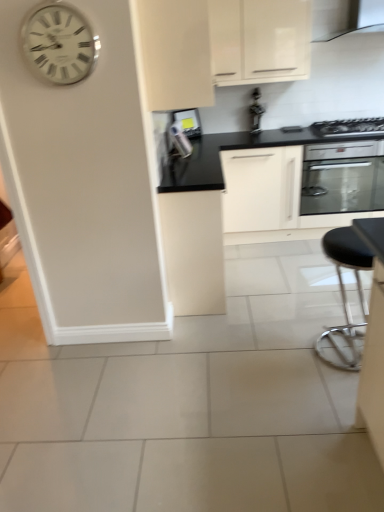
The width and height of the screenshot is (384, 512). I want to click on white matte cabinet at upper center, the 2th cabinetry ordered from the bottom, so coord(175,53).

Describe the element at coordinates (175, 53) in the screenshot. I see `white matte cabinet at upper center, the 2th cabinetry when ordered from top to bottom` at that location.

In order to face black leather stool at lower right, should I rotate leftwards or rightwards?

It's best to rotate right around 20.723 degrees.

What do you see at coordinates (194, 251) in the screenshot?
I see `matte white cabinet at center, the first cabinetry positioned from the bottom` at bounding box center [194, 251].

The height and width of the screenshot is (512, 384). What do you see at coordinates (59, 44) in the screenshot?
I see `white metallic clock at upper left` at bounding box center [59, 44].

At what (x,y) coordinates should I click in order to perform the action: click on white metallic clock at upper left. Please return your answer as a coordinate pair (x, y). Image resolution: width=384 pixels, height=512 pixels. Looking at the image, I should click on (59, 44).

You are a GUI agent. You are given a task and a screenshot of the screen. Output one action in this format:
    pyautogui.click(x=<x>, y=<y>)
    Task: Click on the satin black oven at upper right
    
    Given the screenshot: What is the action you would take?
    pyautogui.click(x=350, y=127)

Based on their sizes in the image, would you say white metallic clock at upper left is bigger or smaller than white glossy cabinet at upper center, positioned as the third cabinetry in bottom-to-top order?

In the image, white metallic clock at upper left appears to be smaller than white glossy cabinet at upper center, positioned as the third cabinetry in bottom-to-top order.

Looking at this image, is white metallic clock at upper left not inside white glossy cabinet at upper center, positioned as the third cabinetry in bottom-to-top order?

white metallic clock at upper left is positioned outside white glossy cabinet at upper center, positioned as the third cabinetry in bottom-to-top order.

Considering the relative positions of white metallic clock at upper left and white glossy cabinet at upper center, positioned as the third cabinetry in bottom-to-top order, in the image provided, is white metallic clock at upper left to the left or to the right of white glossy cabinet at upper center, positioned as the third cabinetry in bottom-to-top order,?

Based on their positions, white metallic clock at upper left is located to the left of white glossy cabinet at upper center, positioned as the third cabinetry in bottom-to-top order.

Does white metallic clock at upper left have a greater height compared to white glossy cabinet at upper center, the first cabinetry positioned from the top?

Incorrect, the height of white metallic clock at upper left is not larger of that of white glossy cabinet at upper center, the first cabinetry positioned from the top.

How much distance is there between matte white cabinet at center, arranged as the 3th cabinetry when viewed from the top, and black glossy exhaust hood at upper right?

2.22 meters.

Is matte white cabinet at center, arranged as the 3th cabinetry when viewed from the top, facing towards black glossy exhaust hood at upper right?

No.

From a real-world perspective, which object stands above the other?

From a 3D spatial view, black glossy exhaust hood at upper right is above.

In the image, is matte white cabinet at center, the first cabinetry positioned from the bottom, positioned in front of or behind black glossy exhaust hood at upper right?

Clearly, matte white cabinet at center, the first cabinetry positioned from the bottom, is in front of black glossy exhaust hood at upper right.

Is satin black oven at upper right inside or outside of matte white cabinet at center, arranged as the 3th cabinetry when viewed from the top?

satin black oven at upper right exists outside the volume of matte white cabinet at center, arranged as the 3th cabinetry when viewed from the top.

Is satin black oven at upper right oriented towards matte white cabinet at center, arranged as the 3th cabinetry when viewed from the top?

No, satin black oven at upper right is not oriented towards matte white cabinet at center, arranged as the 3th cabinetry when viewed from the top.

From the image's perspective, which is above, satin black oven at upper right or matte white cabinet at center, the first cabinetry positioned from the bottom?

satin black oven at upper right is shown above in the image.

Who is taller, satin black oven at upper right or matte white cabinet at center, the first cabinetry positioned from the bottom?

With more height is matte white cabinet at center, the first cabinetry positioned from the bottom.

Does metallic silver toaster at upper center, positioned as the second appliance in left-to-right order, come behind white matte cabinet at upper center, the 2th cabinetry ordered from the bottom?

Yes.

Locate an element on the screen. appliance that is the 2nd object to the right of the white matte cabinet at upper center, the 2th cabinetry when ordered from top to bottom, starting at the anchor is located at coordinates (255, 112).

Does metallic silver toaster at upper center, which is the first appliance in right-to-left order, turn towards white matte cabinet at upper center, the 2th cabinetry ordered from the bottom?

No, metallic silver toaster at upper center, which is the first appliance in right-to-left order, is not turned towards white matte cabinet at upper center, the 2th cabinetry ordered from the bottom.

Can you confirm if matte white cabinet at center, arranged as the 3th cabinetry when viewed from the top, is taller than metallic silver toaster at upper center, positioned as the second appliance in left-to-right order?

Yes.

Between matte white cabinet at center, the first cabinetry positioned from the bottom, and metallic silver toaster at upper center, which is the first appliance in right-to-left order, which one appears on the right side from the viewer's perspective?

metallic silver toaster at upper center, which is the first appliance in right-to-left order.

You are a GUI agent. You are given a task and a screenshot of the screen. Output one action in this format:
    pyautogui.click(x=<x>, y=<y>)
    Task: Click on the cabinetry lying below the metallic silver toaster at upper center, positioned as the second appliance in left-to-right order (from the image's perspective)
    
    Given the screenshot: What is the action you would take?
    pyautogui.click(x=194, y=251)

In the scene shown: From a real-world perspective, between matte white cabinet at center, the first cabinetry positioned from the bottom, and metallic silver toaster at upper center, positioned as the second appliance in left-to-right order, who is vertically lower?

In real-world perspective, matte white cabinet at center, the first cabinetry positioned from the bottom, is lower.

In terms of size, does white metallic clock at upper left appear bigger or smaller than satin black oven at upper right?

Clearly, white metallic clock at upper left is smaller in size than satin black oven at upper right.

Is white metallic clock at upper left thinner than satin black oven at upper right?

Indeed, white metallic clock at upper left has a lesser width compared to satin black oven at upper right.

How distant is white metallic clock at upper left from satin black oven at upper right?

The distance of white metallic clock at upper left from satin black oven at upper right is 2.26 meters.

Is satin black oven at upper right located within white metallic clock at upper left?

No, satin black oven at upper right is located outside of white metallic clock at upper left.

Which of these two, white matte cabinet at upper center, the 2th cabinetry when ordered from top to bottom, or satin black oven at upper right, is smaller?

satin black oven at upper right.

Does white matte cabinet at upper center, the 2th cabinetry when ordered from top to bottom, lie in front of satin black oven at upper right?

Yes, white matte cabinet at upper center, the 2th cabinetry when ordered from top to bottom, is in front of satin black oven at upper right.

Where is `kitchen appliance below the white matte cabinet at upper center, the 2th cabinetry ordered from the bottom (from a real-world perspective)`? The height and width of the screenshot is (512, 384). kitchen appliance below the white matte cabinet at upper center, the 2th cabinetry ordered from the bottom (from a real-world perspective) is located at coordinates (350, 127).

Which of these two, white matte cabinet at upper center, the 2th cabinetry ordered from the bottom, or satin black oven at upper right, stands shorter?

Standing shorter between the two is satin black oven at upper right.

Find the location of a particular element. The image size is (384, 512). cabinetry that is the 3rd object to the right of the white metallic clock at upper left, starting at the anchor is located at coordinates (259, 40).

At what (x,y) coordinates should I click in order to perform the action: click on exhaust hood that is above the matte white cabinet at center, arranged as the 3th cabinetry when viewed from the top (from a real-world perspective). Please return your answer as a coordinate pair (x, y). This screenshot has height=512, width=384. Looking at the image, I should click on (345, 17).

Which object lies further to the anchor point metallic silver toaster at upper center, which is the first appliance in right-to-left order, black leather stool at lower right or metallic silver toaster at upper center, acting as the second appliance starting from the right?

The object further to metallic silver toaster at upper center, which is the first appliance in right-to-left order, is black leather stool at lower right.

Estimate the real-world distances between objects in this image. Which object is further from matte white cabinet at center, arranged as the 3th cabinetry when viewed from the top, satin black oven at upper right or metallic silver toaster at upper center, acting as the second appliance starting from the right?

Based on the image, satin black oven at upper right appears to be further to matte white cabinet at center, arranged as the 3th cabinetry when viewed from the top.

Based on their spatial positions, is white glossy cabinet at upper center, positioned as the third cabinetry in bottom-to-top order, or black glossy exhaust hood at upper right closer to white matte cabinet at upper center, the 2th cabinetry ordered from the bottom?

white glossy cabinet at upper center, positioned as the third cabinetry in bottom-to-top order, is positioned closer to the anchor white matte cabinet at upper center, the 2th cabinetry ordered from the bottom.

Considering their positions, is metallic silver toaster at upper center, which is the 1th appliance in left-to-right order, positioned closer to metallic silver toaster at upper center, which is the first appliance in right-to-left order, than black glossy exhaust hood at upper right?

metallic silver toaster at upper center, which is the 1th appliance in left-to-right order, is closer to metallic silver toaster at upper center, which is the first appliance in right-to-left order.

Considering their positions, is white glossy cabinet at upper center, positioned as the third cabinetry in bottom-to-top order, positioned closer to white matte cabinet at upper center, the 2th cabinetry ordered from the bottom, than matte white cabinet at center, arranged as the 3th cabinetry when viewed from the top?

The object closer to white matte cabinet at upper center, the 2th cabinetry ordered from the bottom, is matte white cabinet at center, arranged as the 3th cabinetry when viewed from the top.

Considering their positions, is white matte cabinet at upper center, the 2th cabinetry ordered from the bottom, positioned further to metallic silver toaster at upper center, which is the 1th appliance in left-to-right order, than black leather stool at lower right?

black leather stool at lower right is positioned further to the anchor metallic silver toaster at upper center, which is the 1th appliance in left-to-right order.

When comparing their distances from white glossy cabinet at upper center, the first cabinetry positioned from the top, does metallic stainless steel oven at center-right or black glossy exhaust hood at upper right seem further?

Among the two, metallic stainless steel oven at center-right is located further to white glossy cabinet at upper center, the first cabinetry positioned from the top.

Based on their spatial positions, is black glossy exhaust hood at upper right or matte white cabinet at center, arranged as the 3th cabinetry when viewed from the top, closer to satin black oven at upper right?

black glossy exhaust hood at upper right is closer to satin black oven at upper right.

Find the location of a particular element. appliance situated between matte white cabinet at center, arranged as the 3th cabinetry when viewed from the top, and satin black oven at upper right from left to right is located at coordinates (255, 112).

Where is `home appliance between white metallic clock at upper left and metallic silver toaster at upper center, acting as the second appliance starting from the right, along the z-axis`? The width and height of the screenshot is (384, 512). home appliance between white metallic clock at upper left and metallic silver toaster at upper center, acting as the second appliance starting from the right, along the z-axis is located at coordinates (343, 178).

This screenshot has width=384, height=512. I want to click on exhaust hood situated between metallic silver toaster at upper center, which is the 1th appliance in left-to-right order, and satin black oven at upper right from left to right, so [345, 17].

Identify the location of wall clock that lies between black glossy exhaust hood at upper right and black leather stool at lower right from top to bottom. This screenshot has width=384, height=512. (59, 44).